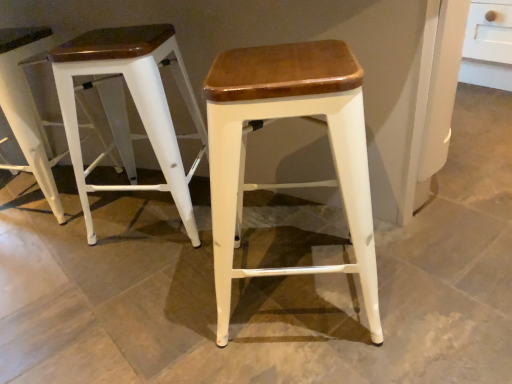
The height and width of the screenshot is (384, 512). What are the coordinates of `empty space that is ontop of white wood stool at center, the third stool when ordered from left to right` in the screenshot? It's located at (278, 64).